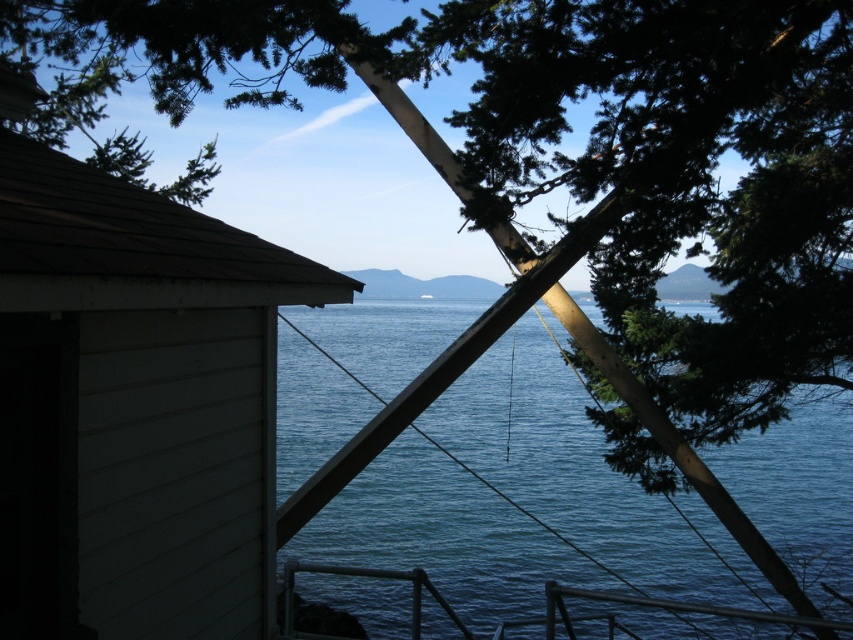
Question: Where is white wood hut at left located in relation to blue water at center in the image?

Choices:
 (A) left
 (B) right

Answer: (A)

Question: Which object is farther from the camera taking this photo?

Choices:
 (A) blue water at center
 (B) white wood hut at left

Answer: (A)

Question: Can you confirm if white wood hut at left is positioned to the left of blue water at center?

Choices:
 (A) yes
 (B) no

Answer: (A)

Question: Is white wood hut at left below blue water at center?

Choices:
 (A) yes
 (B) no

Answer: (B)